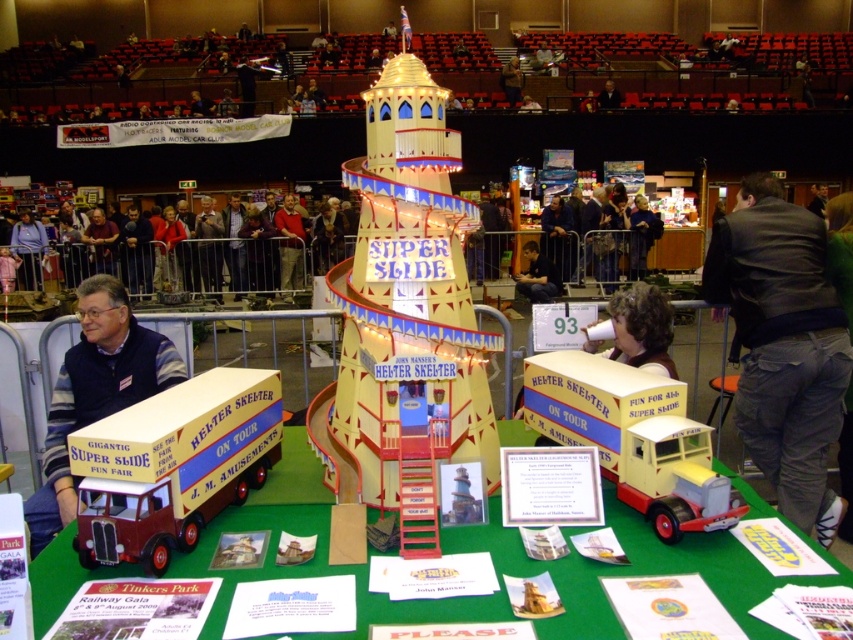
You are a photographer standing at the camera position. You want to take a photo of the helter skelter model but need to ensure the black leather jacket at upper right won

The black leather jacket at upper right is 10.77 feet away from the camera, so it will be in the frame if the photographer is capturing the helter skelter model. However, since the jacket is positioned at the upper right, it might appear in the corner of the photo. To avoid it, the photographer could adjust the angle or move slightly to the left or down.

You are an event organizer at the model exhibition and need to place two promotional banners. One banner is for the matte black vest at left and the other for the dark gray suit at upper center. Based on their positions, which banner should you place on the east side of the exhibition hall?

The matte black vest at left is positioned on the left side of the dark gray suit at upper center. Since the helter skelter is facing the front of the image, the left side would correspond to the east direction. Therefore, the banner for the matte black vest at left should be placed on the east side of the exhibition hall.

You are a delivery person who needs to transport both the dark gray jacket at center and the matte yellow helter skelter at center through a narrow doorway that is 1.2 meters wide. Can both items fit side by side without overlapping?

The dark gray jacket at center might be wider than the matte yellow helter skelter at center. Since the total width of both items combined could exceed 1.2 meters, it is uncertain if they can fit side by side without overlapping. It would be safer to check their exact widths before attempting to move them together.